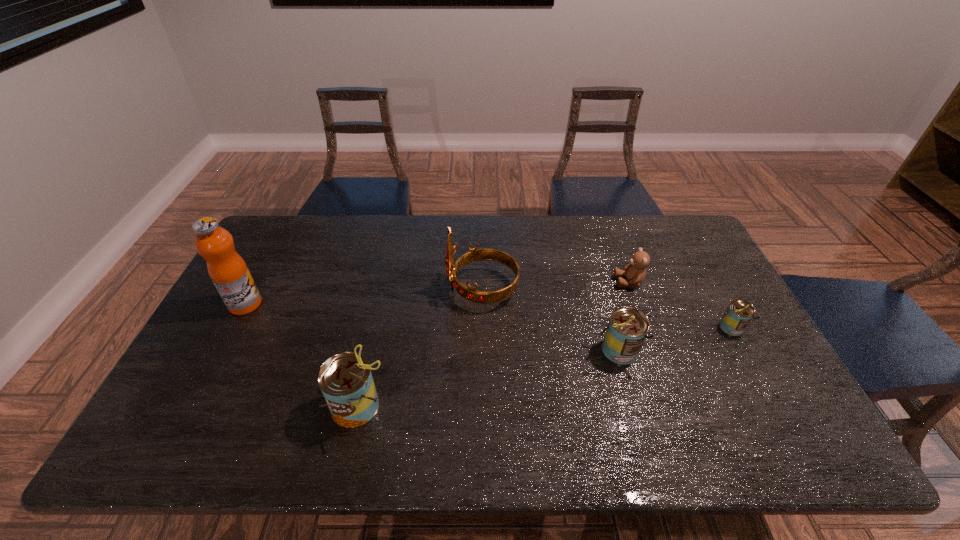
Please point a space for a new can to maintain equal intervals. Please provide its 2D coordinates. Your answer should be formatted as a tuple, i.e. [(x, y)], where the tuple contains the x and y coordinates of a point satisfying the conditions above.

[(495, 377)]